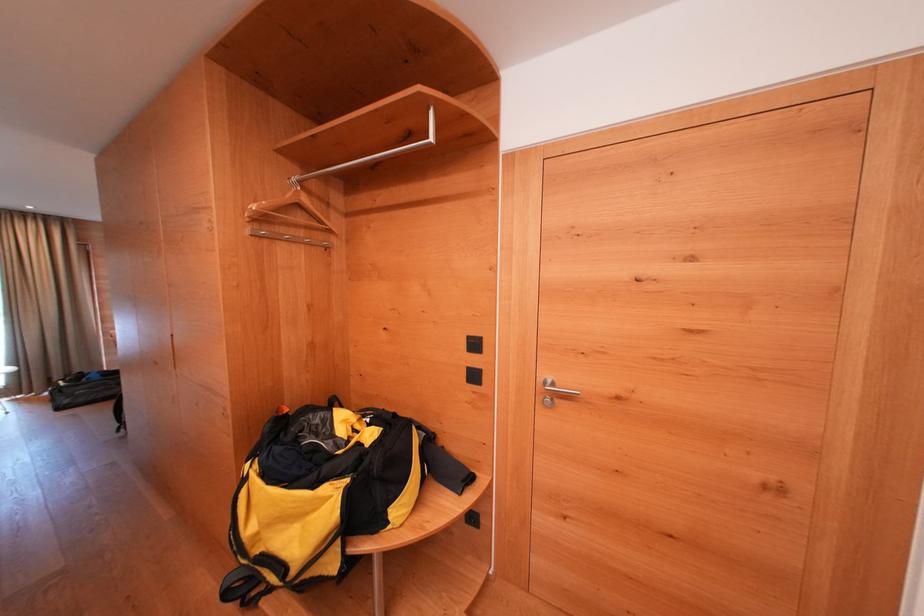
Image resolution: width=924 pixels, height=616 pixels. What do you see at coordinates (553, 392) in the screenshot? I see `the silver door handle` at bounding box center [553, 392].